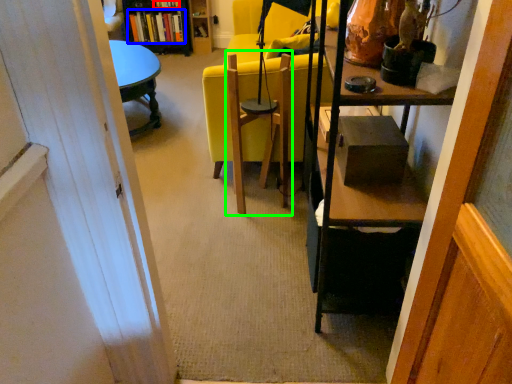
Question: Which is farther away from book (highlighted by a red box)? book (highlighted by a blue box) or swivel chair (highlighted by a green box)?

Choices:
 (A) book
 (B) swivel chair

Answer: (B)